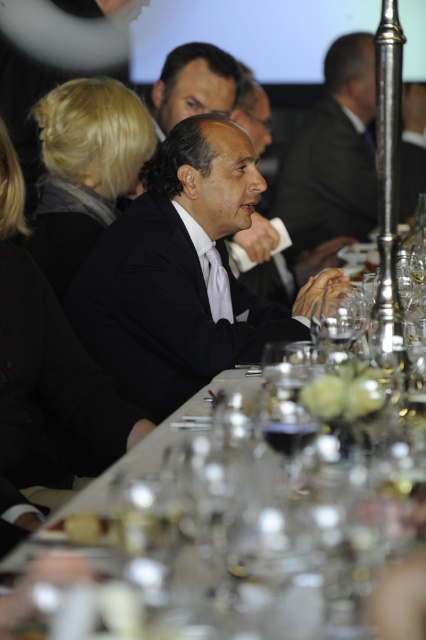
Question: Is the position of clear glass table at center more distant than that of matte black suit at center?

Choices:
 (A) yes
 (B) no

Answer: (B)

Question: Which point is farther from the camera taking this photo?

Choices:
 (A) (273, 444)
 (B) (127, 243)
 (C) (356, 195)
 (D) (304, 614)

Answer: (C)

Question: Is black satin suit at center above matte black suit at center?

Choices:
 (A) yes
 (B) no

Answer: (B)

Question: Which point is farther from the camera taking this photo?

Choices:
 (A) (94, 310)
 (B) (324, 200)
 (C) (302, 371)

Answer: (B)

Question: Estimate the real-world distances between objects in this image. Which object is farther from the matte black suit at center?

Choices:
 (A) clear glass table at center
 (B) transparent glass wine glass at center
 (C) black satin suit at center

Answer: (B)

Question: Does clear glass table at center appear over matte black suit at center?

Choices:
 (A) yes
 (B) no

Answer: (B)